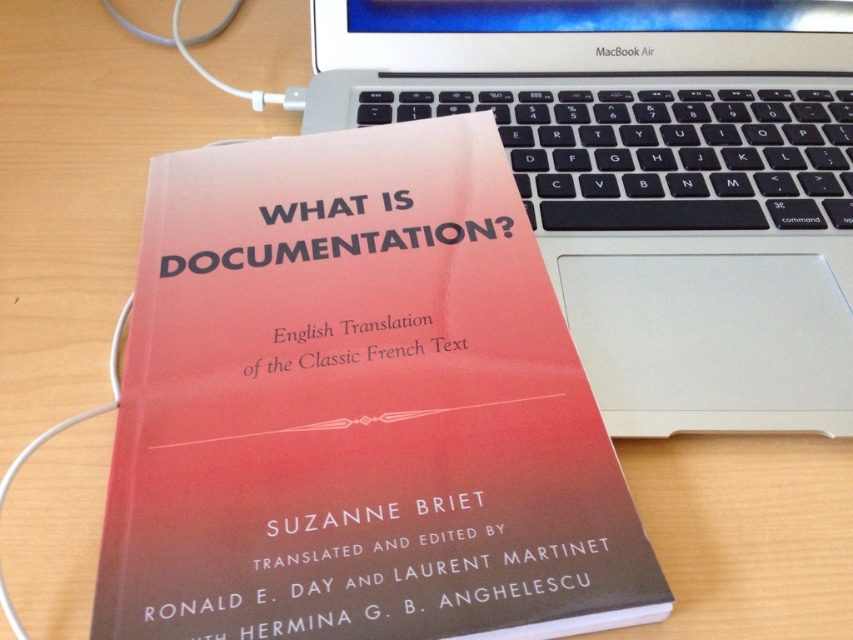
I want to click on matte paper book at center, so click(357, 406).

What do you see at coordinates (357, 406) in the screenshot?
I see `matte paper book at center` at bounding box center [357, 406].

Where is `matte paper book at center`? This screenshot has height=640, width=853. matte paper book at center is located at coordinates (357, 406).